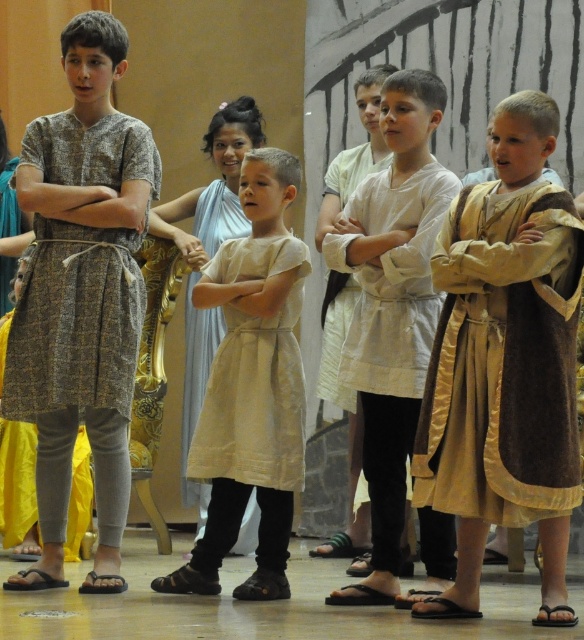
Locate an element on the screen. The width and height of the screenshot is (584, 640). light beige fabric robe at center is located at coordinates (343, 410).

Does light beige fabric robe at center appear on the left side of beige cotton dress at center?

Incorrect, light beige fabric robe at center is not on the left side of beige cotton dress at center.

Identify the location of light beige fabric robe at center. (343, 410).

Consider the image. Is beige fabric dress at center thinner than beige linen dress at center?

Correct, beige fabric dress at center's width is less than beige linen dress at center's.

Is beige fabric dress at center smaller than beige linen dress at center?

Indeed, beige fabric dress at center has a smaller size compared to beige linen dress at center.

Which is in front, point (287, 429) or point (279, 416)?

Positioned in front is point (287, 429).

Where is `beige fabric dress at center`? beige fabric dress at center is located at coordinates (252, 387).

Does gold satin robe at right have a greater width compared to beige linen dress at center?

No, gold satin robe at right is not wider than beige linen dress at center.

Who is more distant from viewer, (484, 266) or (297, 268)?

Point (297, 268)

Identify the location of gold satin robe at right. (505, 362).